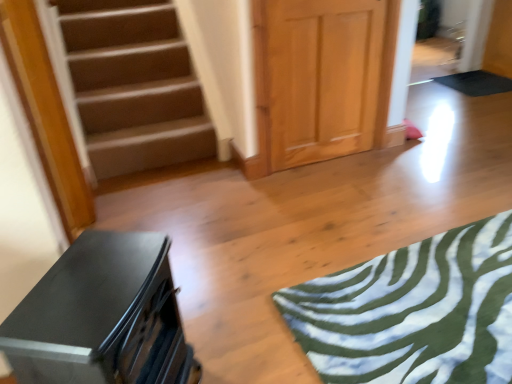
I want to click on free space to the back side of matte black dresser at lower left, so click(214, 316).